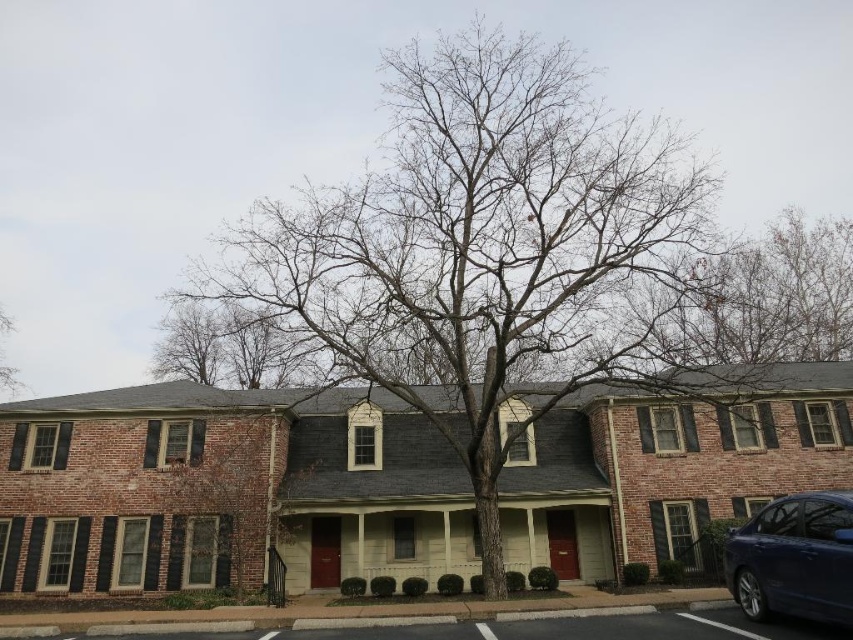
Consider the image. You are a delivery driver arriving at the building and need to park your shiny dark blue sedan at lower right. The building has a driveway that curves around the bare branches at center. Will your car fit without hitting the branches?

The shiny dark blue sedan at lower right is to the right of the bare branches at center, so there should be enough space to park without hitting the branches as long as you stay on your side of the driveway.

You are standing in front of the two story brick building and want to take a photo. You notice two points marked on your camera screen at coordinates point (x=647, y=273) and point (x=834, y=500). Which point is closer to the camera?

Point (x=647, y=273) is further to the camera than point (x=834, y=500). Therefore, point (x=834, y=500) is closer to the camera.